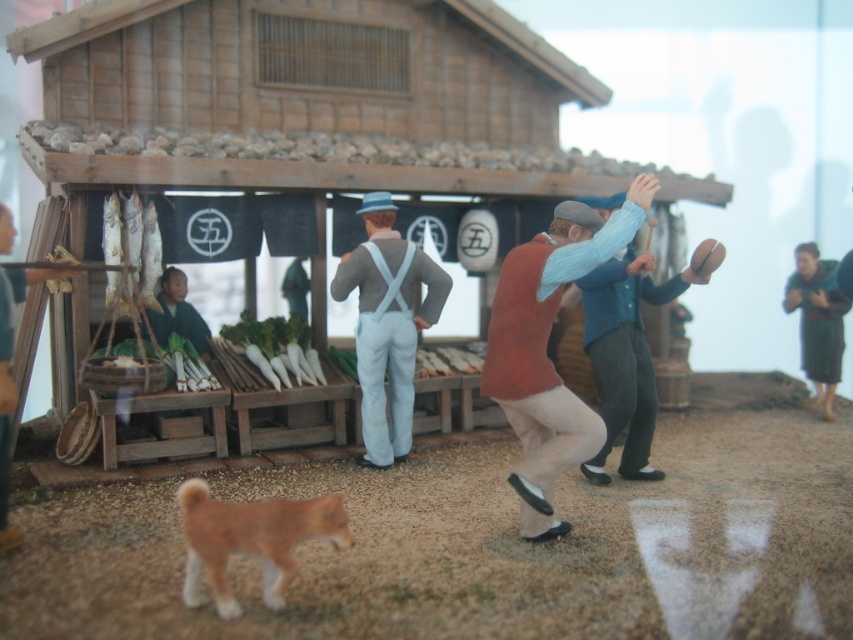
Question: Which point is closer to the camera?

Choices:
 (A) blue wool sweater at right
 (B) matte gray suspenders at center
 (C) light blue sweater at center
 (D) green woolen sweater at right

Answer: (C)

Question: Can you confirm if matte gray suspenders at center is wider than blue wool sweater at right?

Choices:
 (A) yes
 (B) no

Answer: (B)

Question: Based on their relative distances, which object is farther from the matte gray suspenders at center?

Choices:
 (A) blue wool sweater at right
 (B) green woolen sweater at right

Answer: (B)

Question: Observing the image, what is the correct spatial positioning of light blue sweater at center in reference to green woolen sweater at right?

Choices:
 (A) left
 (B) right

Answer: (A)

Question: Based on their relative distances, which object is nearer to the blue wool sweater at right?

Choices:
 (A) matte gray suspenders at center
 (B) green woolen sweater at right

Answer: (A)

Question: Can you confirm if light blue sweater at center is bigger than matte gray suspenders at center?

Choices:
 (A) no
 (B) yes

Answer: (A)